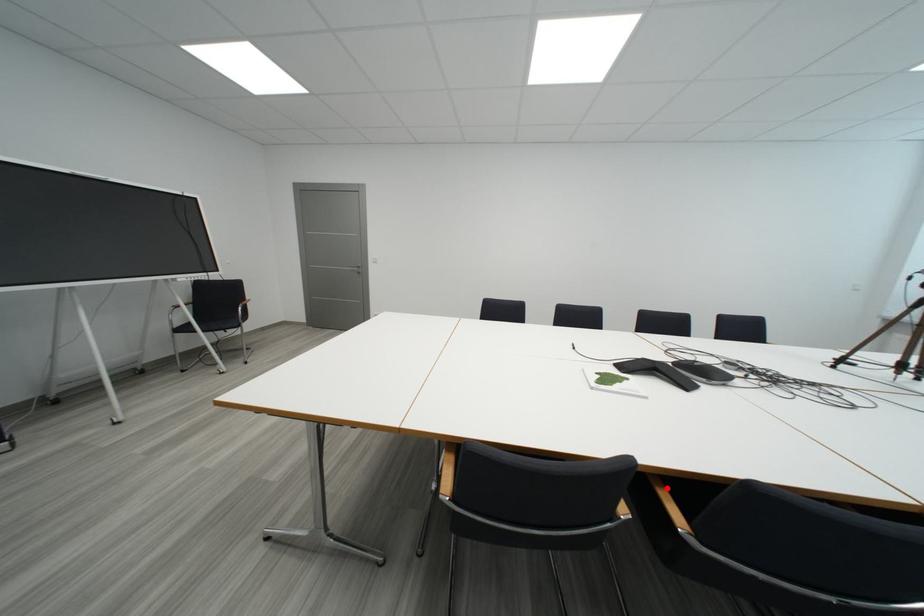
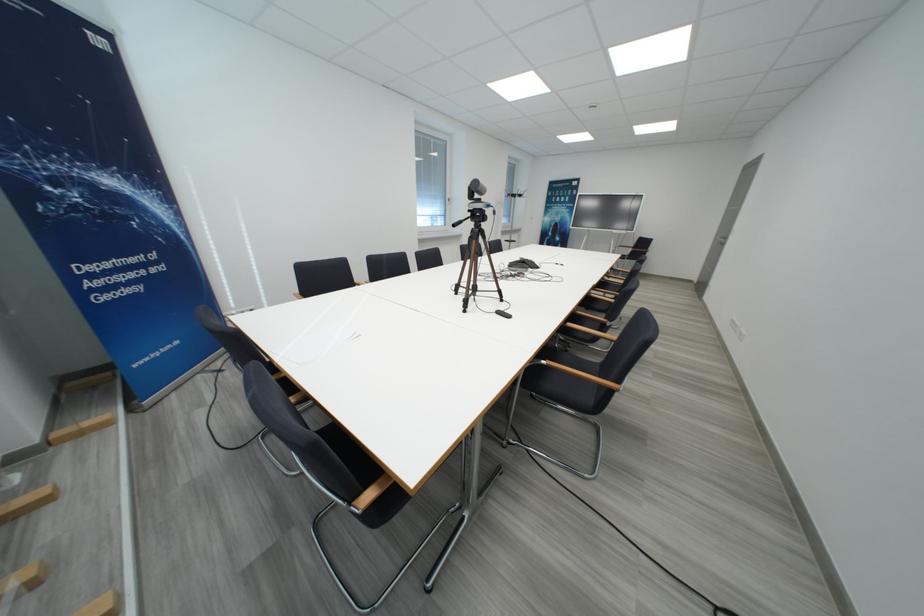
Question: I am providing you with two images of the same scene from different viewpoints. A red point is marked on the first image. Is the red point's position out of view in image 2?

Choices:
 (A) Yes
 (B) No

Answer: (A)